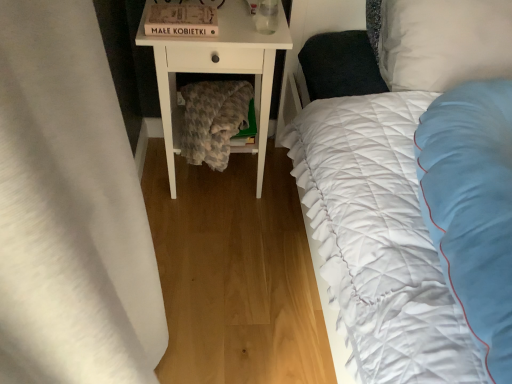
Find the location of `blank space situated above matte cardboard box at upper center (from a real-world perspective)`. blank space situated above matte cardboard box at upper center (from a real-world perspective) is located at coordinates (180, 15).